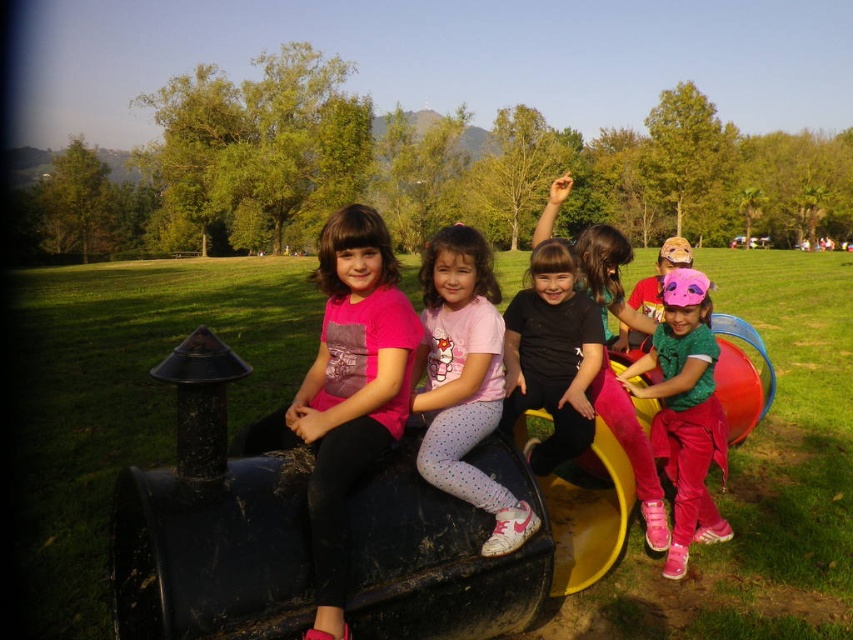
Question: From the image, what is the correct spatial relationship of matte pink shirt at left in relation to pink matte leggings at center?

Choices:
 (A) right
 (B) left

Answer: (B)

Question: Can you confirm if matte pink shirt at left is smaller than black matte shirt at center?

Choices:
 (A) yes
 (B) no

Answer: (B)

Question: From the image, what is the correct spatial relationship of matte pink shirt at left in relation to black matte shirt at center?

Choices:
 (A) right
 (B) left

Answer: (B)

Question: Which of the following is the farthest from the observer?

Choices:
 (A) (315, 408)
 (B) (552, 435)
 (C) (722, 540)
 (D) (474, 435)

Answer: (C)

Question: Which of the following is the closest to the observer?

Choices:
 (A) matte pink shirt at left
 (B) black matte shirt at center
 (C) pink fabric mask at center
 (D) pink matte leggings at center

Answer: (A)

Question: Among these objects, which one is farthest from the camera?

Choices:
 (A) matte pink shirt at left
 (B) black matte shirt at center
 (C) pink fabric mask at center
 (D) pink matte leggings at center

Answer: (C)